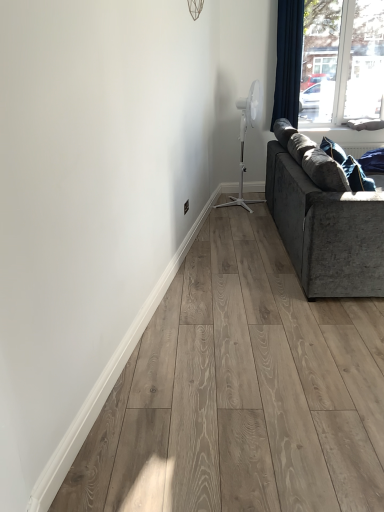
Question: From a real-world perspective, does transparent glass window at upper right stand above dark blue fabric curtain at upper right?

Choices:
 (A) yes
 (B) no

Answer: (A)

Question: Is dark blue fabric curtain at upper right at the back of transparent glass window at upper right?

Choices:
 (A) yes
 (B) no

Answer: (B)

Question: From the image's perspective, is transparent glass window at upper right under dark blue fabric curtain at upper right?

Choices:
 (A) no
 (B) yes

Answer: (A)

Question: From the image's perspective, is transparent glass window at upper right located above dark blue fabric curtain at upper right?

Choices:
 (A) no
 (B) yes

Answer: (B)

Question: Does transparent glass window at upper right touch dark blue fabric curtain at upper right?

Choices:
 (A) no
 (B) yes

Answer: (A)

Question: Can you confirm if transparent glass window at upper right is positioned to the right of dark blue fabric curtain at upper right?

Choices:
 (A) yes
 (B) no

Answer: (A)

Question: Is transparent glass window at upper right behind white plastic fan at upper right?

Choices:
 (A) yes
 (B) no

Answer: (A)

Question: Is white plastic fan at upper right at the back of transparent glass window at upper right?

Choices:
 (A) no
 (B) yes

Answer: (A)

Question: Is transparent glass window at upper right oriented towards white plastic fan at upper right?

Choices:
 (A) yes
 (B) no

Answer: (B)

Question: From a real-world perspective, is transparent glass window at upper right positioned over white plastic fan at upper right based on gravity?

Choices:
 (A) no
 (B) yes

Answer: (B)

Question: Considering the relative positions of transparent glass window at upper right and white plastic fan at upper right in the image provided, is transparent glass window at upper right to the right of white plastic fan at upper right from the viewer's perspective?

Choices:
 (A) yes
 (B) no

Answer: (A)

Question: Is transparent glass window at upper right next to white plastic fan at upper right?

Choices:
 (A) yes
 (B) no

Answer: (B)

Question: Are white plastic fan at upper right and velvet grey couch at right far apart?

Choices:
 (A) no
 (B) yes

Answer: (B)